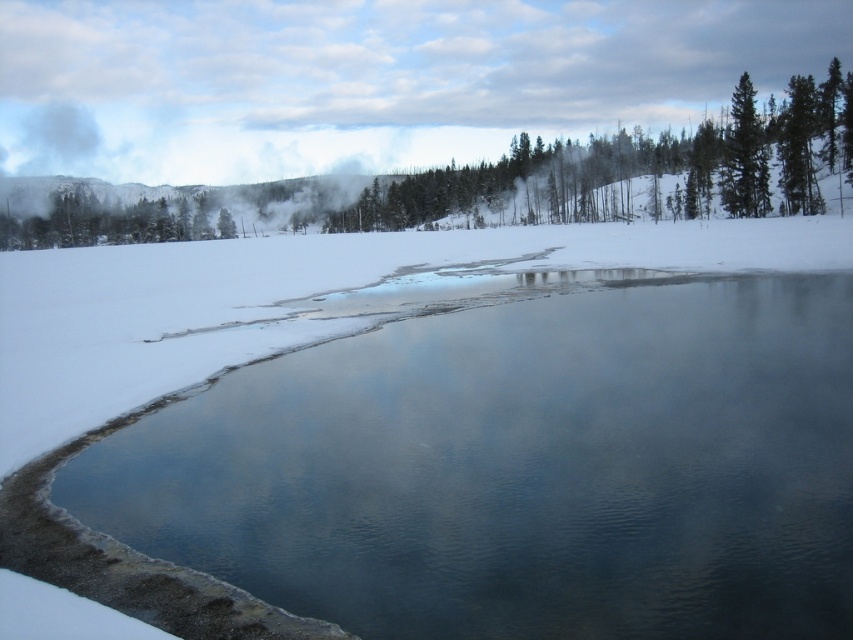
You are a photographer planning to capture the winter landscape. You want to ensure both the clear water at center and the green textured tree at upper center are visible in your shot. Based on their sizes, which object should you focus on to frame the scene properly?

The clear water at center has a lesser width compared to the green textured tree at upper center, so you should focus on the green textured tree at upper center to ensure both elements are framed properly.

You are standing at the edge of the winter landscape and want to reach the clear water at center. Based on the coordinates provided in the description, in which direction should you move relative to your current position?

The clear water at center is located at coordinates point (521,468), so you should move towards the center of the image to reach it.

You are standing at the edge of the clear water at center and want to look at the green matte tree at upper right. Which object appears larger in the scene?

The green matte tree at upper right appears larger than the clear water at center because it is stated that the clear water at center is smaller than the green matte tree at upper right.